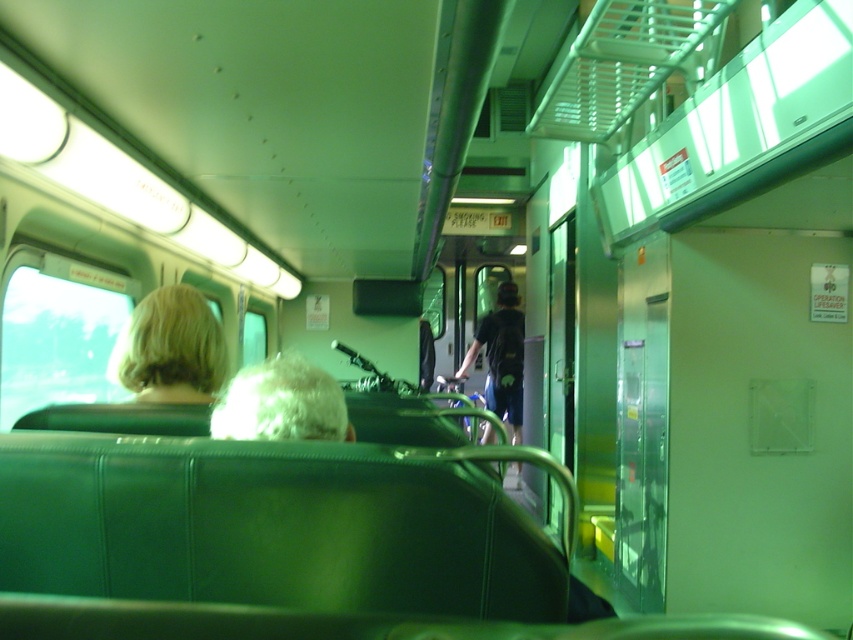
You are a passenger on the train and want to move from the point at coordinates point (107, 372) to the point at coordinates point (271, 380). Which direction should you move in?

You should move forward towards the point at coordinates point (271, 380) because point (107, 372) is behind it.